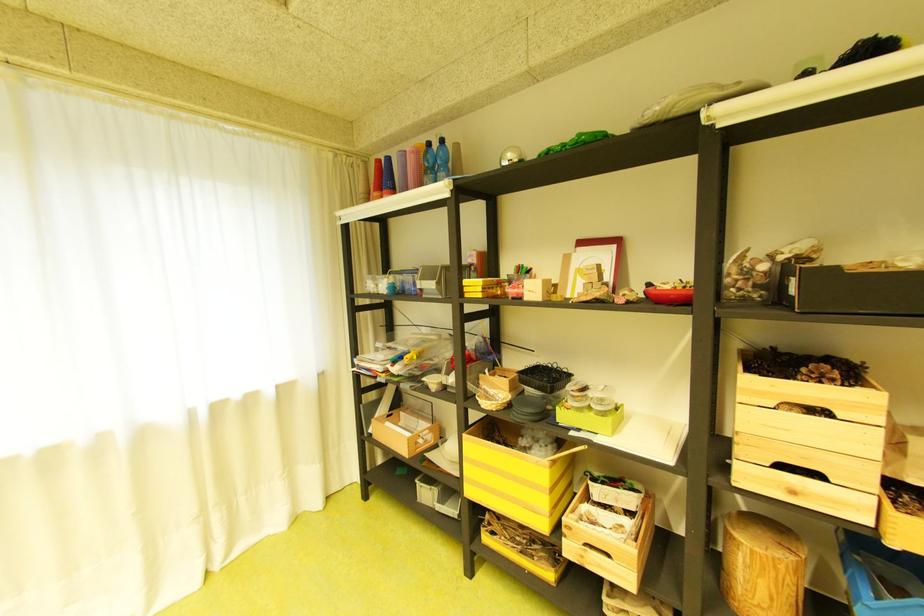
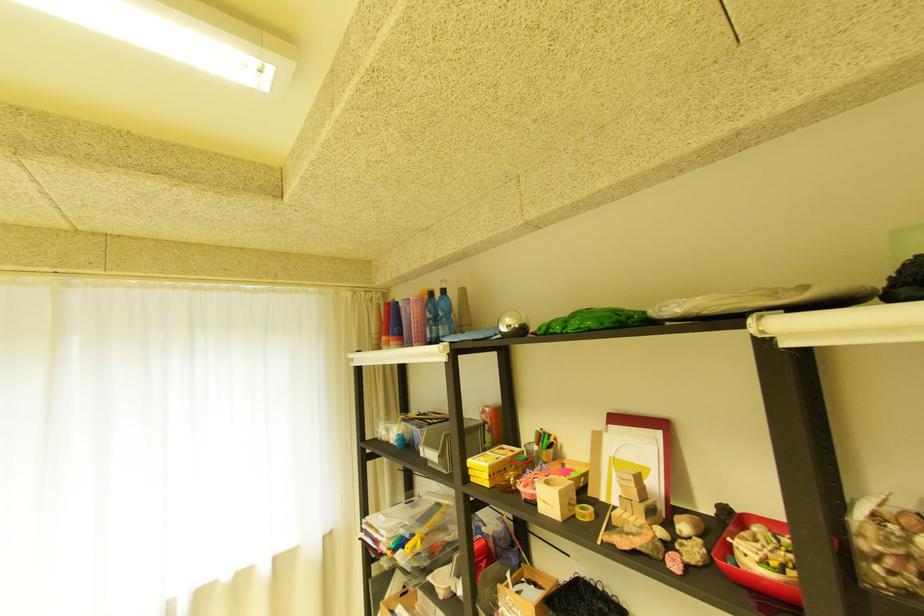
Question: Based on the continuous images, in which direction is the camera rotating? Reply with the corresponding letter.

Choices:
 (A) Left
 (B) Right
 (C) Up
 (D) Down

Answer: (C)